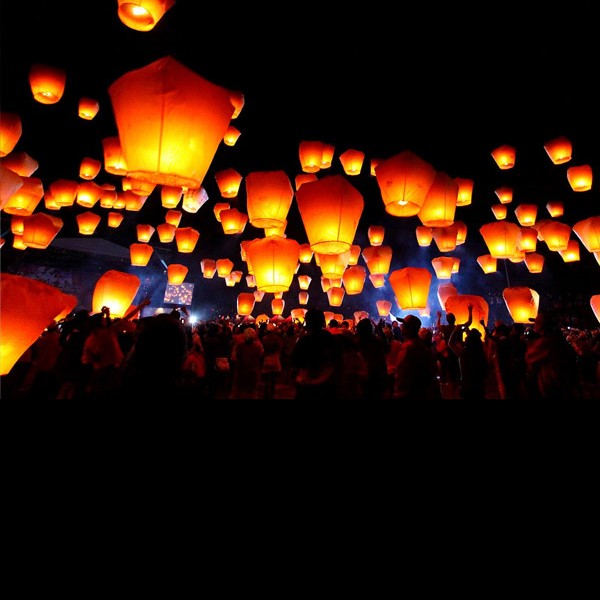
Locate an element on the screen. monitor is located at coordinates pyautogui.click(x=183, y=293).